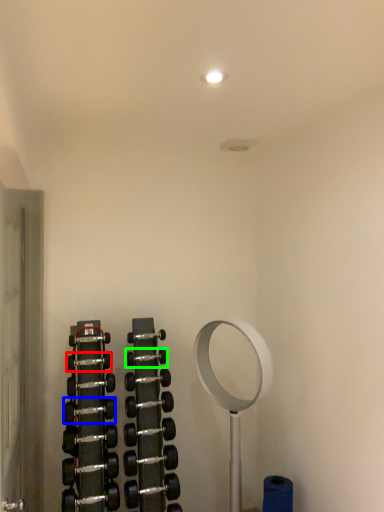
Question: Estimate the real-world distances between objects in this image. Which object is farther from dumbbell (highlighted by a red box), dumbbell (highlighted by a blue box) or dumbbell (highlighted by a green box)?

Choices:
 (A) dumbbell
 (B) dumbbell

Answer: (A)